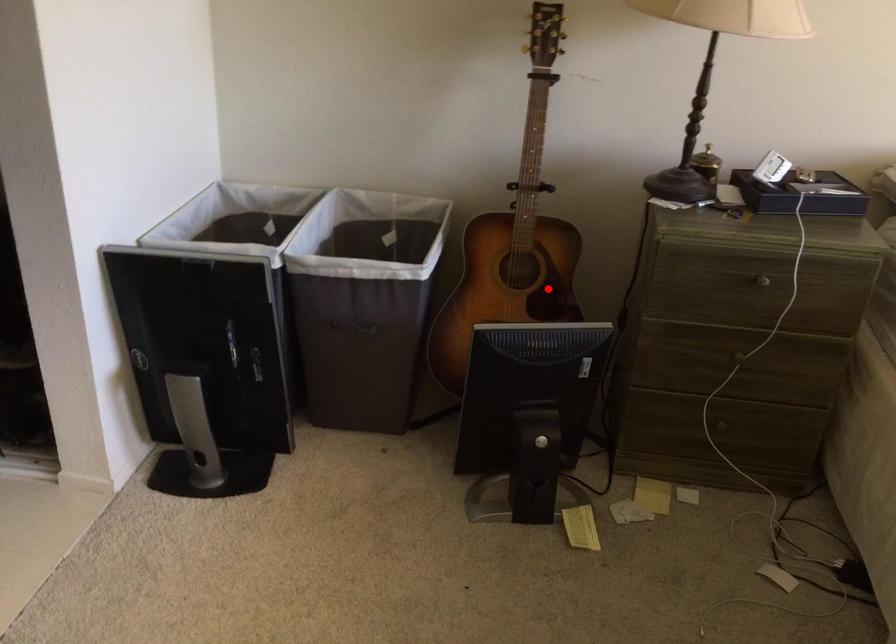
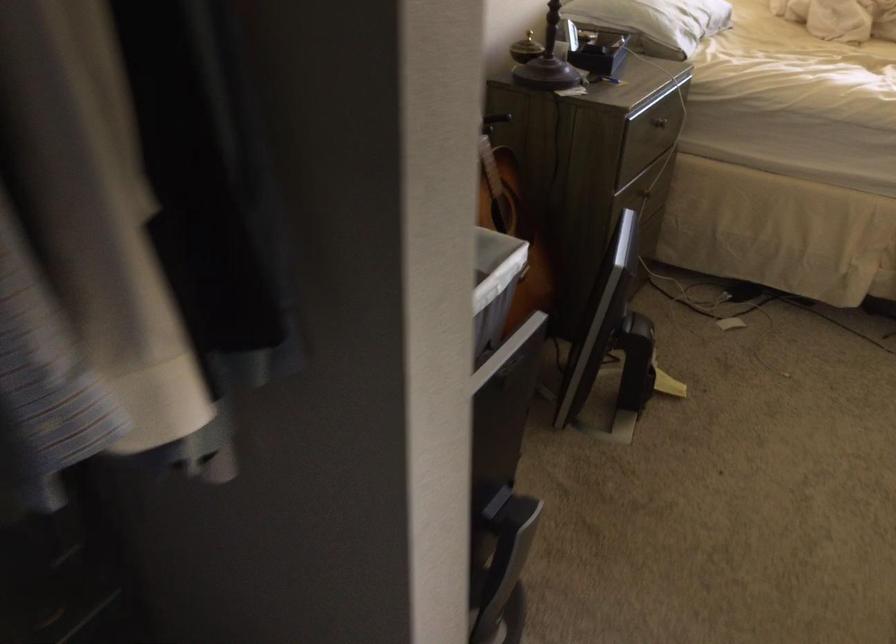
Question: I am providing you with two images of the same scene from different viewpoints. A red point is marked on the first image. At the location where the point appears in image 1, is it still visible in image 2?

Choices:
 (A) Yes
 (B) No

Answer: (A)